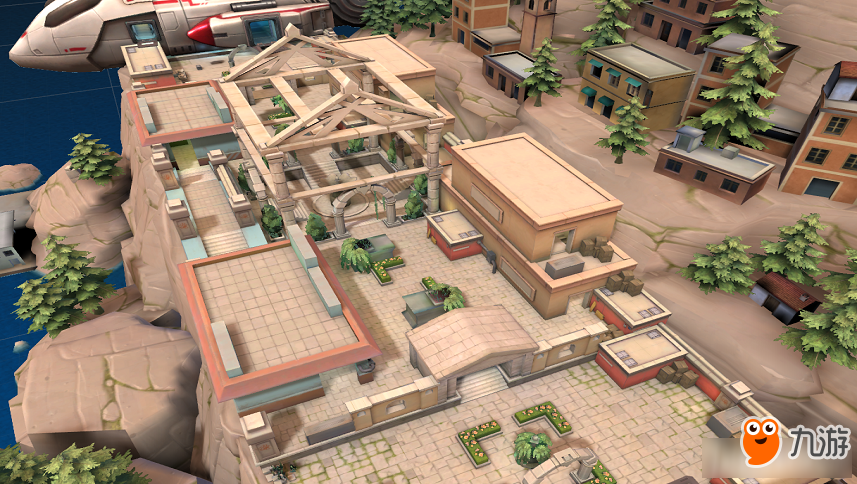
Locate an element on the screen. door is located at coordinates (826, 186), (500, 82).